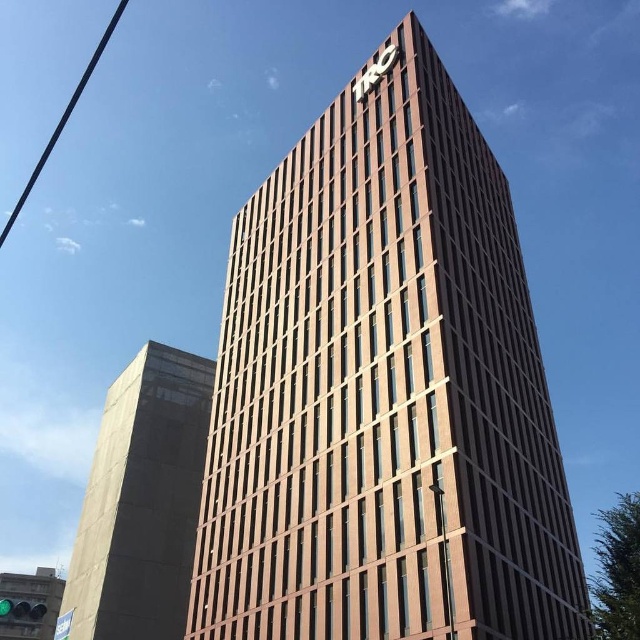
Question: Does brown brick building at center appear under black wire at upper left?

Choices:
 (A) yes
 (B) no

Answer: (A)

Question: Can you confirm if concrete tower at left is thinner than black wire at upper left?

Choices:
 (A) no
 (B) yes

Answer: (B)

Question: Which of these objects is positioned closest to the brown brick building at center?

Choices:
 (A) black wire at upper left
 (B) concrete tower at left

Answer: (B)

Question: Which of the following is the farthest from the observer?

Choices:
 (A) (461, 518)
 (B) (56, 136)

Answer: (B)

Question: Can you confirm if brown brick building at center is positioned to the left of concrete tower at left?

Choices:
 (A) yes
 (B) no

Answer: (B)

Question: Which point is closer to the camera?

Choices:
 (A) black wire at upper left
 (B) brown brick building at center
 (C) concrete tower at left

Answer: (B)